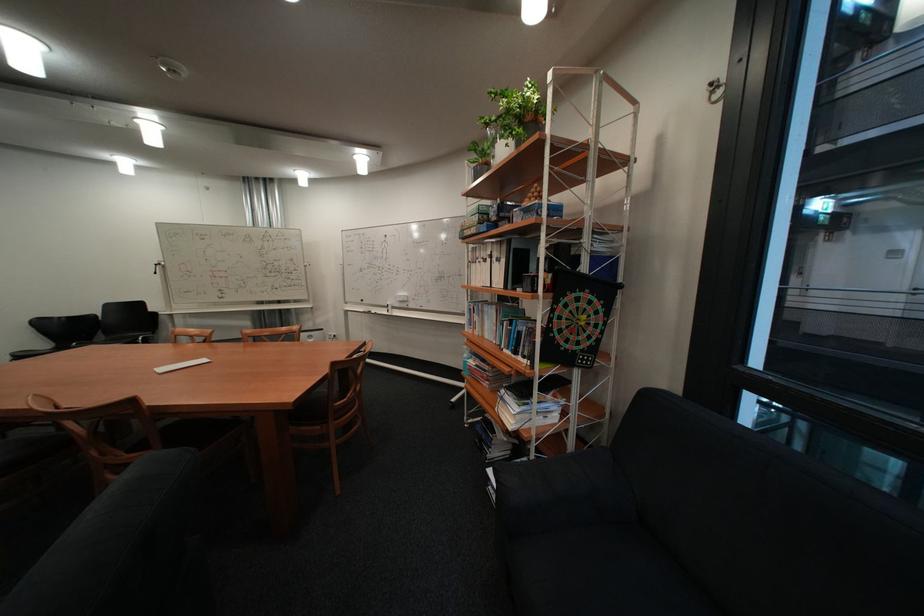
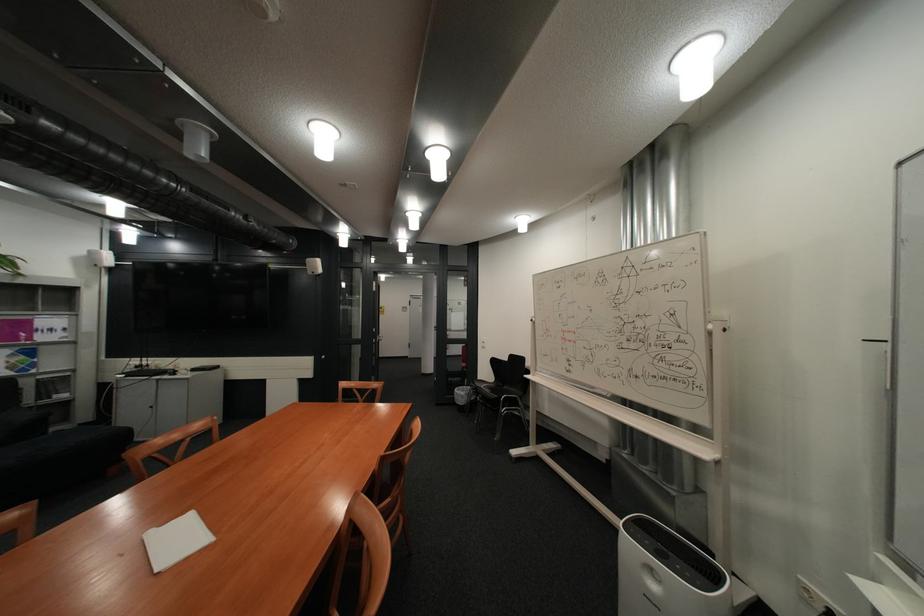
The point at (x=39, y=355) is marked in the first image. Where is the corresponding point in the second image?

(493, 383)